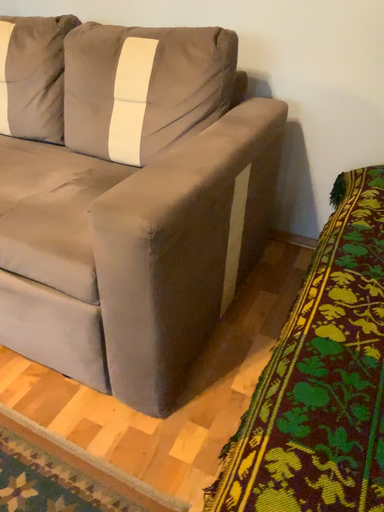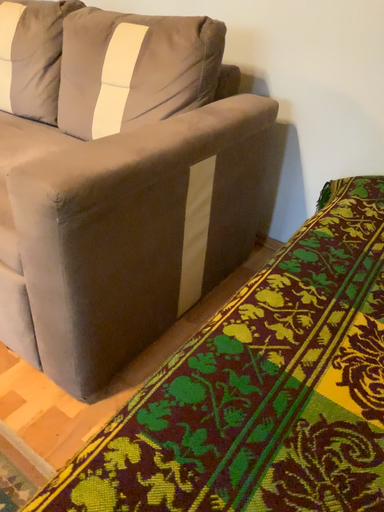
Question: How did the camera likely rotate when shooting the video?

Choices:
 (A) rotated left
 (B) rotated right

Answer: (A)